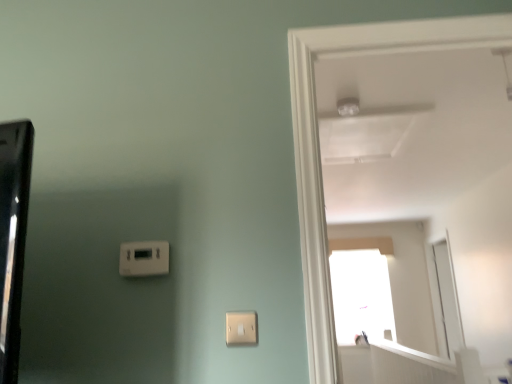
Question: Does white glossy door at upper right have a lesser height compared to white plastic light switch at lower center, the first light switch viewed from the right?

Choices:
 (A) no
 (B) yes

Answer: (A)

Question: Is white glossy door at upper right beside white plastic light switch at lower center, which is the 1th light switch from front to back?

Choices:
 (A) yes
 (B) no

Answer: (B)

Question: Considering the relative sizes of white glossy door at upper right and white plastic light switch at lower center, the first light switch positioned from the bottom, in the image provided, is white glossy door at upper right smaller than white plastic light switch at lower center, the first light switch positioned from the bottom,?

Choices:
 (A) yes
 (B) no

Answer: (B)

Question: From a real-world perspective, is white glossy door at upper right positioned under white plastic light switch at lower center, the first light switch viewed from the right, based on gravity?

Choices:
 (A) yes
 (B) no

Answer: (B)

Question: From the image's perspective, is white glossy door at upper right below white plastic light switch at lower center, the second light switch when ordered from left to right?

Choices:
 (A) yes
 (B) no

Answer: (B)

Question: Is point (316, 210) positioned closer to the camera than point (256, 344)?

Choices:
 (A) closer
 (B) farther

Answer: (B)

Question: From the image's perspective, is white glossy door at upper right positioned above or below white plastic light switch at lower center, the first light switch viewed from the right?

Choices:
 (A) above
 (B) below

Answer: (A)

Question: Based on their sizes in the image, would you say white glossy door at upper right is bigger or smaller than white plastic light switch at lower center, the first light switch viewed from the right?

Choices:
 (A) small
 (B) big

Answer: (B)

Question: Choose the correct answer: Is white glossy door at upper right inside white plastic light switch at lower center, the 2th light switch positioned from the back, or outside it?

Choices:
 (A) outside
 (B) inside

Answer: (A)

Question: Visually, is white plastic thermostat at lower left, which is the first light switch in left-to-right order, positioned to the left or to the right of white plastic light switch at lower center, the 2th light switch positioned from the back?

Choices:
 (A) right
 (B) left

Answer: (B)

Question: Is white plastic thermostat at lower left, which is the first light switch in left-to-right order, in front of or behind white plastic light switch at lower center, positioned as the second light switch in top-to-bottom order, in the image?

Choices:
 (A) behind
 (B) front

Answer: (A)

Question: Is point (164, 248) positioned closer to the camera than point (243, 319)?

Choices:
 (A) farther
 (B) closer

Answer: (A)

Question: In terms of size, does white plastic thermostat at lower left, which ranks as the second light switch in right-to-left order, appear bigger or smaller than white plastic light switch at lower center, the 2th light switch positioned from the back?

Choices:
 (A) small
 (B) big

Answer: (B)

Question: From a real-world perspective, is white glossy door at upper right above or below white plastic thermostat at lower left, which ranks as the second light switch in right-to-left order?

Choices:
 (A) below
 (B) above

Answer: (B)

Question: Is white glossy door at upper right taller or shorter than white plastic thermostat at lower left, which ranks as the second light switch in right-to-left order?

Choices:
 (A) short
 (B) tall

Answer: (B)